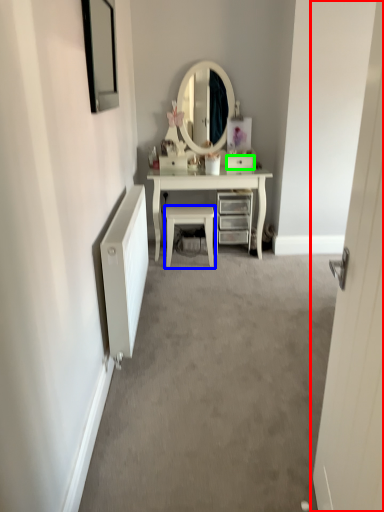
Question: Considering the real-world distances, which object is farthest from door (highlighted by a red box)? chair (highlighted by a blue box) or drawer (highlighted by a green box)?

Choices:
 (A) chair
 (B) drawer

Answer: (B)